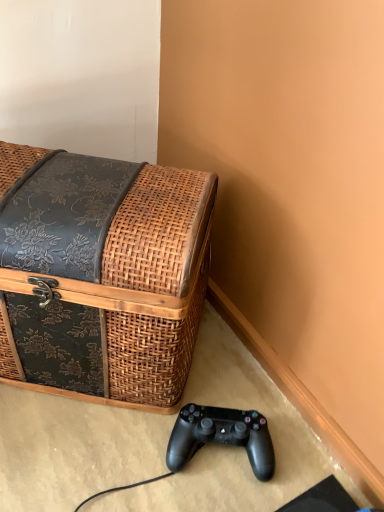
At what (x,y) coordinates should I click in order to perform the action: click on vacant space behind black matte game controller at lower center. Please return your answer as a coordinate pair (x, y). This screenshot has width=384, height=512. Looking at the image, I should click on (226, 375).